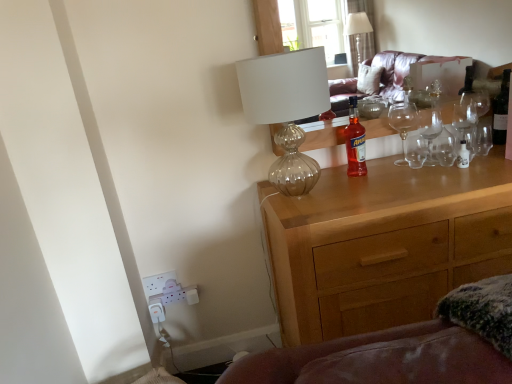
Question: Does translucent glass bottle at center have a larger size compared to wooden chest of drawers at center?

Choices:
 (A) yes
 (B) no

Answer: (B)

Question: Is translucent glass bottle at center facing away from wooden chest of drawers at center?

Choices:
 (A) no
 (B) yes

Answer: (A)

Question: Does translucent glass bottle at center appear on the right side of wooden chest of drawers at center?

Choices:
 (A) yes
 (B) no

Answer: (B)

Question: Would you say translucent glass bottle at center is outside wooden chest of drawers at center?

Choices:
 (A) no
 (B) yes

Answer: (B)

Question: Can you confirm if translucent glass bottle at center is taller than wooden chest of drawers at center?

Choices:
 (A) no
 (B) yes

Answer: (A)

Question: In terms of width, does wooden chest of drawers at center look wider or thinner when compared to dark glass wine bottle at upper right?

Choices:
 (A) wide
 (B) thin

Answer: (A)

Question: In the image, is wooden chest of drawers at center positioned in front of or behind dark glass wine bottle at upper right?

Choices:
 (A) front
 (B) behind

Answer: (A)

Question: From the image's perspective, is wooden chest of drawers at center positioned above or below dark glass wine bottle at upper right?

Choices:
 (A) below
 (B) above

Answer: (A)

Question: Considering the positions of wooden chest of drawers at center and dark glass wine bottle at upper right in the image, is wooden chest of drawers at center bigger or smaller than dark glass wine bottle at upper right?

Choices:
 (A) small
 (B) big

Answer: (B)

Question: Looking at their shapes, would you say dark glass wine bottle at upper right is wider or thinner than wooden chest of drawers at center?

Choices:
 (A) wide
 (B) thin

Answer: (B)

Question: Considering the positions of dark glass wine bottle at upper right and wooden chest of drawers at center in the image, is dark glass wine bottle at upper right taller or shorter than wooden chest of drawers at center?

Choices:
 (A) short
 (B) tall

Answer: (A)

Question: From a real-world perspective, is dark glass wine bottle at upper right physically located above or below wooden chest of drawers at center?

Choices:
 (A) above
 (B) below

Answer: (A)

Question: Considering the relative positions of dark glass wine bottle at upper right and wooden chest of drawers at center in the image provided, is dark glass wine bottle at upper right to the left or to the right of wooden chest of drawers at center?

Choices:
 (A) left
 (B) right

Answer: (B)

Question: Relative to translucent glass lamp at upper center, is wooden chest of drawers at center in front or behind?

Choices:
 (A) behind
 (B) front

Answer: (A)

Question: Is point (365, 188) positioned closer to the camera than point (286, 132)?

Choices:
 (A) closer
 (B) farther

Answer: (A)